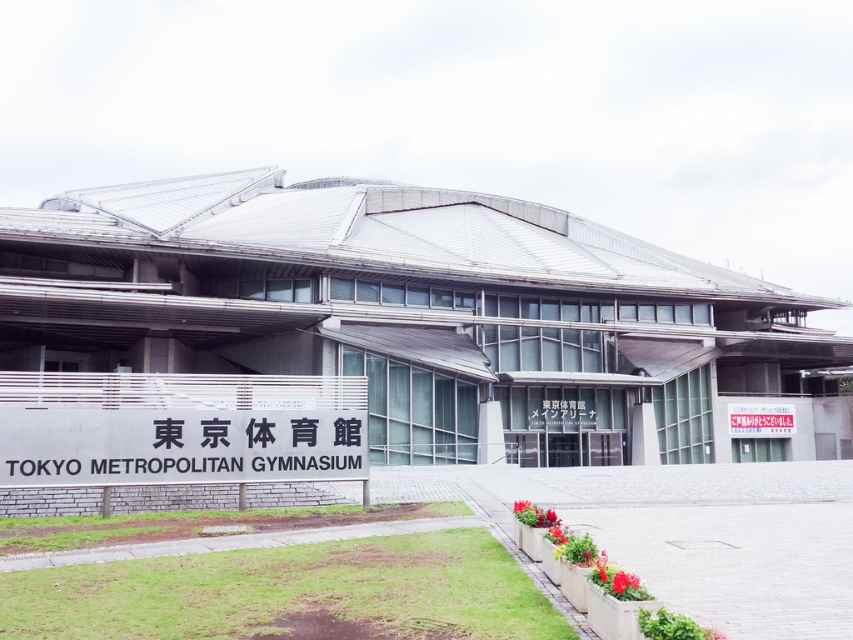
You are a tourist standing in front of the Tokyo Metropolitan Gymnasium and see the black sign at center and the white paper sign at center. Which sign is positioned higher?

The black sign at center is located above the white paper sign at center, so it is positioned higher.

You are standing at the entrance of the Tokyo Metropolitan Gymnasium and want to locate the black sign at center. According to the coordinates given, where should you look relative to your current position?

The black sign at center is located at coordinates point (178,445), which means it is positioned to the right and slightly below your current line of sight.

You are a tourist standing in front of the Tokyo Metropolitan Gymnasium and see the black sign at center and the white paper sign at center. Which sign is positioned to the left?

The black sign at center is to the left of the white paper sign at center, so the black sign at center is positioned to the left.